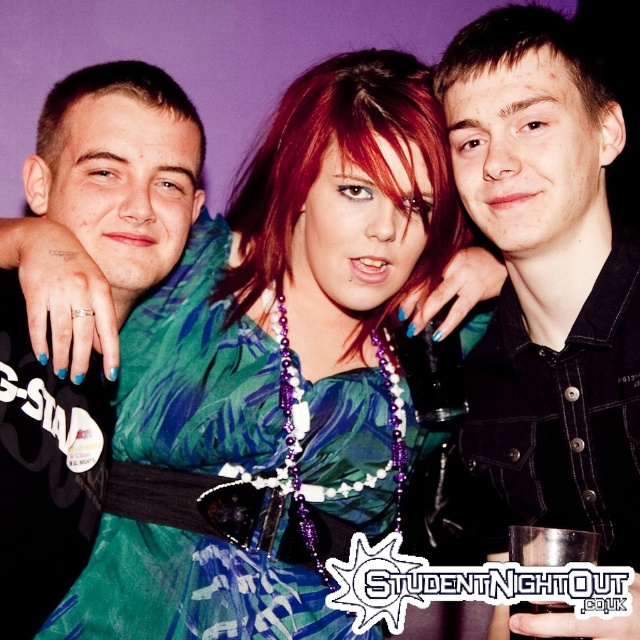
Based on the photo, you are a photographer at the StudentNightOut event. You are holding a camera and want to capture a closeup shot of the green satin dress at center. The camera has a minimum focusing distance of 1.0 meters. Can you take the photo without moving closer?

The green satin dress at center and camera are 1.03 meters apart from each other. Since the minimum focusing distance is 1.0 meters, you can take the photo without moving closer because the distance is sufficient.

You are a photographer at the StudentNightOut event. You need to position a spotlight on the black denim jacket at upper center without shining it on the matte black shirt at center. Based on their positions, can you do this?

The black denim jacket at upper center is to the right of the matte black shirt at center, so yes, you can position the spotlight on the black denim jacket at upper center without shining it on the matte black shirt at center by angling it to the right side.

You are standing at the entrance of the venue and want to check if you can reach the black denim jacket at upper center without moving closer. Your arm can extend 2.5 feet. Can you reach it?

The black denim jacket at upper center is 3.31 feet away from you. Since your arm can only extend 2.5 feet, you cannot reach it without moving closer.